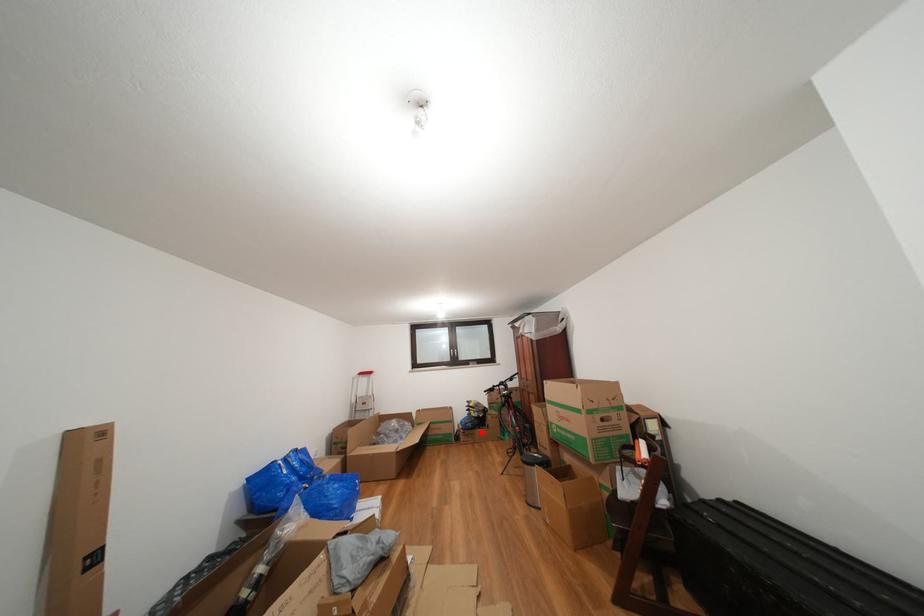
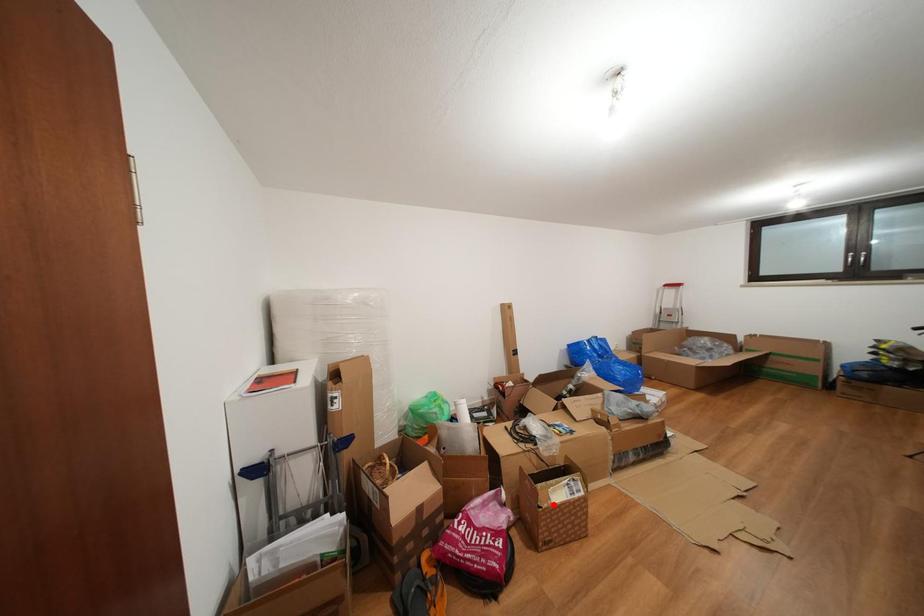
I am providing you with two images of the same scene from different viewpoints. A red point is marked on the first image and another point is marked on the second image. Is the marked point in image1 the same physical position as the marked point in image2?

No